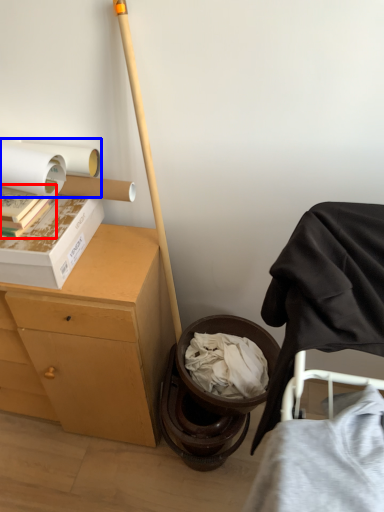
Question: Which of the following is the closest to the observer, book (highlighted by a red box) or toilet paper (highlighted by a blue box)?

Choices:
 (A) book
 (B) toilet paper

Answer: (A)